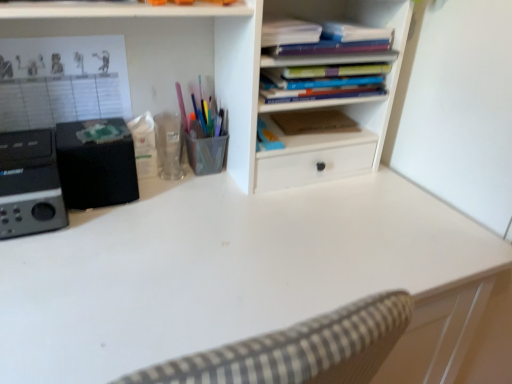
Identify the location of black plastic speaker at left. This screenshot has width=512, height=384. (29, 184).

In order to face white matte desk at center, should I rotate leftwards or rightwards?

Rotate left and turn 7.963 degrees.

Measure the distance between white matte desk at center and camera.

The distance of white matte desk at center from camera is 54.07 centimeters.

At what (x,y) coordinates should I click in order to perform the action: click on matte blue notebook at upper center, marked as the second book in a bottom-to-top arrangement. Please return your answer as a coordinate pair (x, y). The height and width of the screenshot is (384, 512). Looking at the image, I should click on (322, 38).

At what (x,y) coordinates should I click in order to perform the action: click on appliance below the brown matte paper at center (from a real-world perspective). Please return your answer as a coordinate pair (x, y). The width and height of the screenshot is (512, 384). Looking at the image, I should click on pos(29,184).

Is black plastic speaker at left spatially inside brown matte paper at center, or outside of it?

black plastic speaker at left lies outside brown matte paper at center.

From a real-world perspective, is black plastic speaker at left positioned over brown matte paper at center based on gravity?

Incorrect, from a real-world perspective, black plastic speaker at left is lower than brown matte paper at center.

Who is bigger, black plastic speaker at left or brown matte paper at center?

black plastic speaker at left is bigger.

Who is shorter, hardcover books at upper center, marked as the 1th book in a bottom-to-top arrangement, or translucent plastic pen holder at center?

With less height is hardcover books at upper center, marked as the 1th book in a bottom-to-top arrangement.

Considering their positions, is hardcover books at upper center, which is the second book from top to bottom, located in front of or behind translucent plastic pen holder at center?

Visually, hardcover books at upper center, which is the second book from top to bottom, is located in front of translucent plastic pen holder at center.

Looking at their sizes, would you say hardcover books at upper center, which is the second book from top to bottom, is wider or thinner than translucent plastic pen holder at center?

hardcover books at upper center, which is the second book from top to bottom, is wider than translucent plastic pen holder at center.

Do you think hardcover books at upper center, which is the second book from top to bottom, is within translucent plastic pen holder at center, or outside of it?

hardcover books at upper center, which is the second book from top to bottom, lies outside translucent plastic pen holder at center.

Is white matte desk at center looking in the opposite direction of hardcover books at upper center, which is the second book from top to bottom?

white matte desk at center is not turned away from hardcover books at upper center, which is the second book from top to bottom.

How different are the orientations of white matte desk at center and hardcover books at upper center, which is the second book from top to bottom, in degrees?

There is a 164-degree angle between the facing directions of white matte desk at center and hardcover books at upper center, which is the second book from top to bottom.

From the image's perspective, would you say white matte desk at center is positioned over hardcover books at upper center, which is the second book from top to bottom?

Actually, white matte desk at center appears below hardcover books at upper center, which is the second book from top to bottom, in the image.

Can we say white matte desk at center lies outside hardcover books at upper center, marked as the 1th book in a bottom-to-top arrangement?

Yes, white matte desk at center is outside of hardcover books at upper center, marked as the 1th book in a bottom-to-top arrangement.

Is white matte desk at center wider than black plastic speaker at left?

Correct, the width of white matte desk at center exceeds that of black plastic speaker at left.

Is white matte desk at center at the right side of black plastic speaker at left?

Yes, white matte desk at center is to the right of black plastic speaker at left.

Who is bigger, white matte desk at center or black plastic speaker at left?

Bigger between the two is white matte desk at center.

Where is `desk in front of the black plastic speaker at left`? The height and width of the screenshot is (384, 512). desk in front of the black plastic speaker at left is located at coordinates pyautogui.click(x=239, y=275).

Is hardcover books at upper center, which is the second book from top to bottom, oriented away from black matte speaker at left?

No, hardcover books at upper center, which is the second book from top to bottom, is not facing away from black matte speaker at left.

Can you tell me how much hardcover books at upper center, which is the second book from top to bottom, and black matte speaker at left differ in facing direction?

0.829 degrees separate the facing orientations of hardcover books at upper center, which is the second book from top to bottom, and black matte speaker at left.

From the image's perspective, would you say hardcover books at upper center, which is the second book from top to bottom, is shown under black matte speaker at left?

No, from the image's perspective, hardcover books at upper center, which is the second book from top to bottom, is not below black matte speaker at left.

Who is shorter, hardcover books at upper center, marked as the 1th book in a bottom-to-top arrangement, or black matte speaker at left?

With less height is hardcover books at upper center, marked as the 1th book in a bottom-to-top arrangement.

Is point (65, 146) positioned behind point (193, 166)?

No, it is in front of (193, 166).

Is black matte speaker at left oriented away from translucent plastic pen holder at center?

black matte speaker at left does not have its back to translucent plastic pen holder at center.

Can you confirm if black matte speaker at left is shorter than translucent plastic pen holder at center?

Incorrect, the height of black matte speaker at left does not fall short of that of translucent plastic pen holder at center.

Is black matte speaker at left at the right side of translucent plastic pen holder at center?

No.

Does white matte desk at center have a greater height compared to black matte speaker at left?

Yes.

Which of these two, white matte desk at center or black matte speaker at left, is wider?

With larger width is white matte desk at center.

From the image's perspective, which is above, white matte desk at center or black matte speaker at left?

black matte speaker at left, from the image's perspective.

Which of these two, white matte desk at center or black matte speaker at left, is smaller?

black matte speaker at left.

This screenshot has width=512, height=384. In order to click on paperback book that is behind the black plastic speaker at left in this screenshot , I will do `click(314, 122)`.

Find the location of `stationery that is below the hardcover books at upper center, which is the second book from top to bottom (from the image's perspective)`. stationery that is below the hardcover books at upper center, which is the second book from top to bottom (from the image's perspective) is located at coordinates (203, 136).

Considering their positions, is white matte desk at center positioned closer to black matte speaker at left than black plastic speaker at left?

black plastic speaker at left is closer to black matte speaker at left.

Estimate the real-world distances between objects in this image. Which object is further from translucent plastic pen holder at center, black matte speaker at left or white matte desk at center?

white matte desk at center is further to translucent plastic pen holder at center.

In the scene shown: Looking at the image, which one is located further to black plastic speaker at left, white matte desk at center or brown matte paper at center?

brown matte paper at center is positioned further to the anchor black plastic speaker at left.

Estimate the real-world distances between objects in this image. Which object is further from white matte desk at center, black matte speaker at left or hardcover books at upper center, marked as the 1th book in a bottom-to-top arrangement?

Based on the image, hardcover books at upper center, marked as the 1th book in a bottom-to-top arrangement, appears to be further to white matte desk at center.

Considering their positions, is brown matte paper at center positioned closer to black matte speaker at left than black plastic speaker at left?

black plastic speaker at left lies closer to black matte speaker at left than the other object.

Based on the photo, looking at the image, which one is located further to hardcover books at upper center, marked as the 1th book in a bottom-to-top arrangement, black matte speaker at left or matte blue notebook at upper center, which ranks as the first book in top-to-bottom order?

black matte speaker at left lies further to hardcover books at upper center, marked as the 1th book in a bottom-to-top arrangement, than the other object.

Considering their positions, is black plastic speaker at left positioned closer to black matte speaker at left than matte blue notebook at upper center, marked as the second book in a bottom-to-top arrangement?

black plastic speaker at left.

Based on their spatial positions, is black matte speaker at left or brown matte paper at center further from hardcover books at upper center, which is the second book from top to bottom?

The object further to hardcover books at upper center, which is the second book from top to bottom, is black matte speaker at left.

Where is `speaker located between black plastic speaker at left and matte blue notebook at upper center, marked as the second book in a bottom-to-top arrangement, in the left-right direction`? The image size is (512, 384). speaker located between black plastic speaker at left and matte blue notebook at upper center, marked as the second book in a bottom-to-top arrangement, in the left-right direction is located at coordinates (95, 170).

In order to click on speaker that lies between matte blue notebook at upper center, which ranks as the first book in top-to-bottom order, and white matte desk at center from top to bottom in this screenshot , I will do `click(95, 170)`.

Locate an element on the screen. The image size is (512, 384). speaker located between black plastic speaker at left and hardcover books at upper center, marked as the 1th book in a bottom-to-top arrangement, in the left-right direction is located at coordinates (x=95, y=170).

Where is `speaker located between black plastic speaker at left and translucent plastic pen holder at center in the left-right direction`? speaker located between black plastic speaker at left and translucent plastic pen holder at center in the left-right direction is located at coordinates (95, 170).